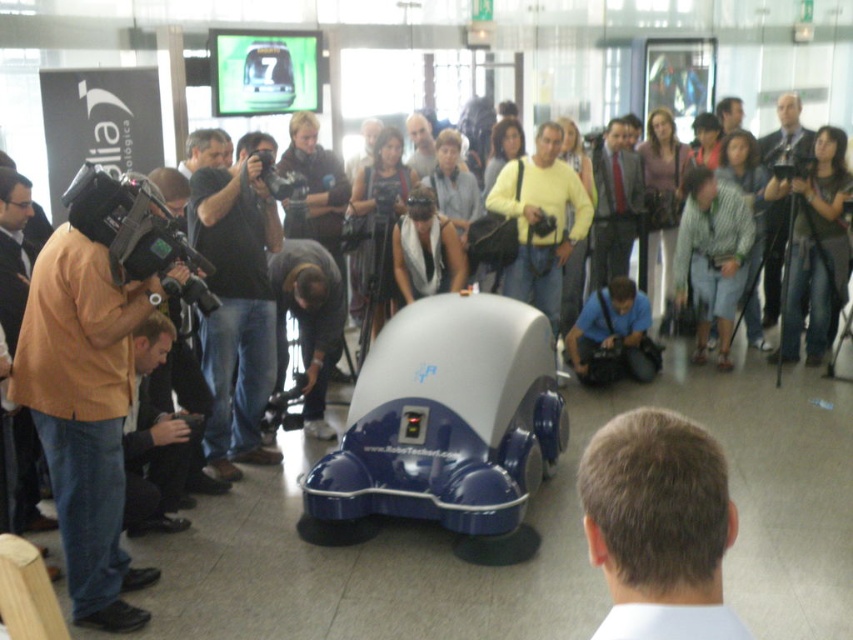
Question: Is matte black camera at left further to the viewer compared to green glossy car at center?

Choices:
 (A) no
 (B) yes

Answer: (A)

Question: Does brown hair at center have a larger size compared to black plastic video camera at left?

Choices:
 (A) yes
 (B) no

Answer: (B)

Question: Which object appears closest to the camera in this image?

Choices:
 (A) blue glossy toy car at center
 (B) brown leather jacket at left
 (C) black fabric camera at left

Answer: (B)

Question: Which point is closer to the camera?

Choices:
 (A) matte black camera at left
 (B) brown hair at center
 (C) black fabric camera at left
 (D) blue glossy toy car at center

Answer: (B)

Question: Which object is the closest to the black plastic video camera at left?

Choices:
 (A) black fabric camera at left
 (B) dark gray fabric at center
 (C) brown leather jacket at left

Answer: (C)

Question: Can you confirm if brown leather jacket at left is smaller than matte black camera at left?

Choices:
 (A) yes
 (B) no

Answer: (B)